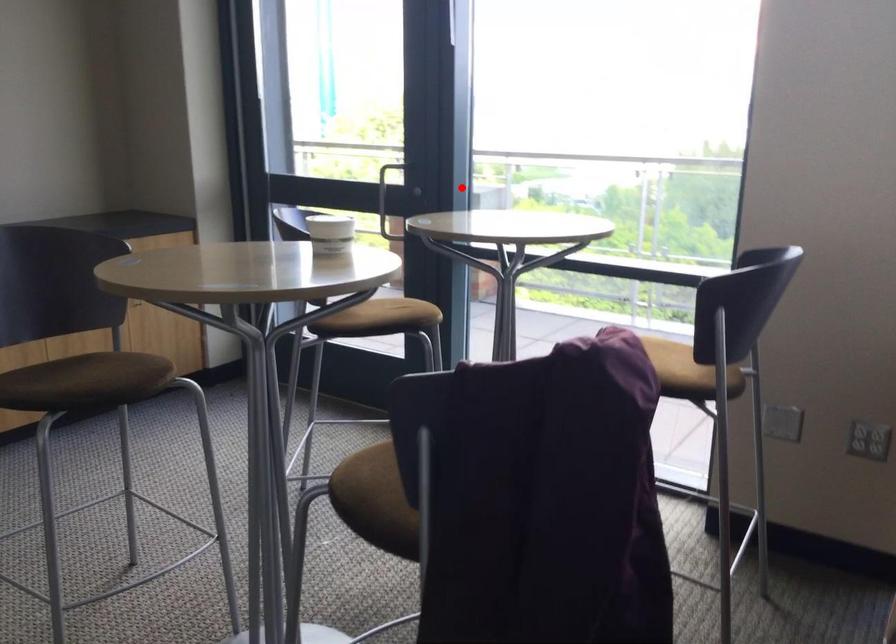
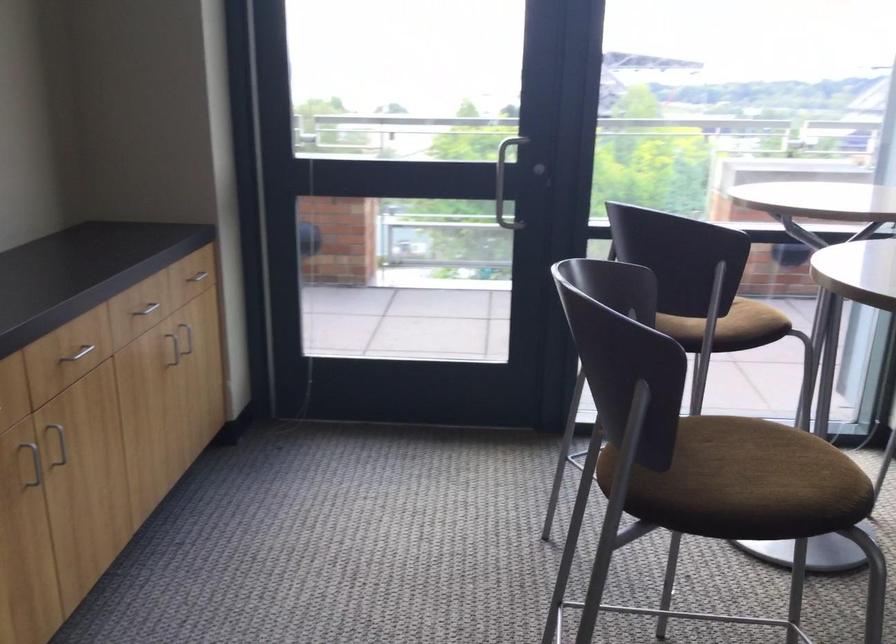
Question: I am providing you with two images of the same scene from different viewpoints. Image1 has a red point marked. In image2, the corresponding 3D location appears at what relative position? Reply with the corresponding letter.

Choices:
 (A) Closer
 (B) Farther

Answer: (A)